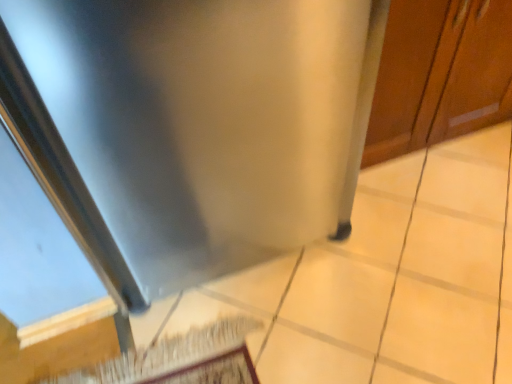
Question: From the image's perspective, would you say stainless steel at lower right is shown under stainless steel refrigerator at center?

Choices:
 (A) no
 (B) yes

Answer: (B)

Question: Is stainless steel at lower right placed right next to stainless steel refrigerator at center?

Choices:
 (A) yes
 (B) no

Answer: (B)

Question: Does stainless steel at lower right have a lesser height compared to stainless steel refrigerator at center?

Choices:
 (A) no
 (B) yes

Answer: (A)

Question: Is stainless steel at lower right closer to camera compared to stainless steel refrigerator at center?

Choices:
 (A) yes
 (B) no

Answer: (A)

Question: Could you tell me if stainless steel at lower right is facing stainless steel refrigerator at center?

Choices:
 (A) yes
 (B) no

Answer: (B)

Question: Is stainless steel at lower right at the left side of stainless steel refrigerator at center?

Choices:
 (A) yes
 (B) no

Answer: (A)

Question: Considering the relative positions of stainless steel refrigerator at center and stainless steel at lower right in the image provided, is stainless steel refrigerator at center to the right of stainless steel at lower right from the viewer's perspective?

Choices:
 (A) no
 (B) yes

Answer: (B)

Question: Does stainless steel refrigerator at center have a greater height compared to stainless steel at lower right?

Choices:
 (A) yes
 (B) no

Answer: (B)

Question: Can stainless steel at lower right be found inside stainless steel refrigerator at center?

Choices:
 (A) yes
 (B) no

Answer: (B)

Question: Considering the relative sizes of stainless steel refrigerator at center and stainless steel at lower right in the image provided, is stainless steel refrigerator at center bigger than stainless steel at lower right?

Choices:
 (A) yes
 (B) no

Answer: (B)

Question: From a real-world perspective, is stainless steel refrigerator at center on top of stainless steel at lower right?

Choices:
 (A) yes
 (B) no

Answer: (B)

Question: Is stainless steel refrigerator at center located outside stainless steel at lower right?

Choices:
 (A) yes
 (B) no

Answer: (A)

Question: Looking at their shapes, would you say stainless steel refrigerator at center is wider or thinner than stainless steel at lower right?

Choices:
 (A) wide
 (B) thin

Answer: (B)